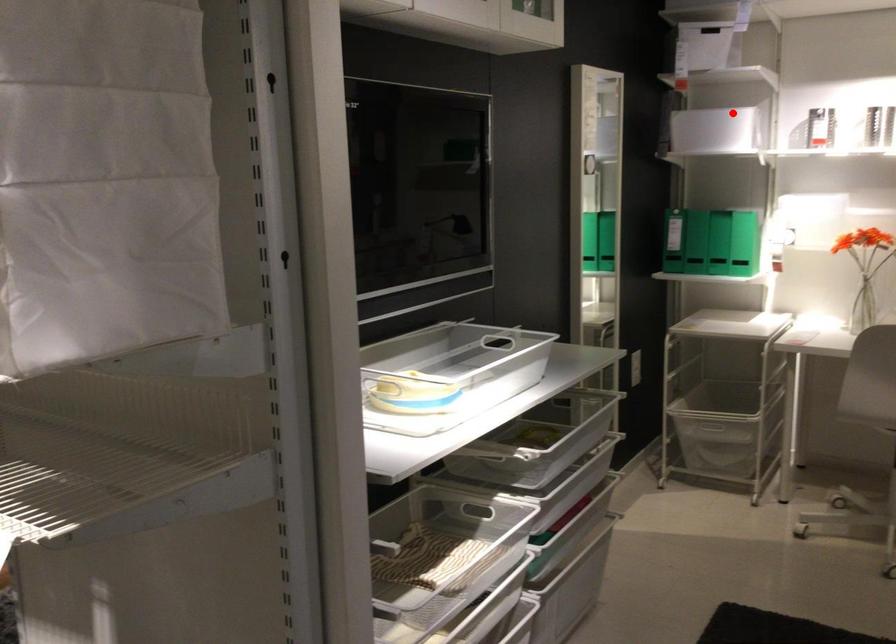
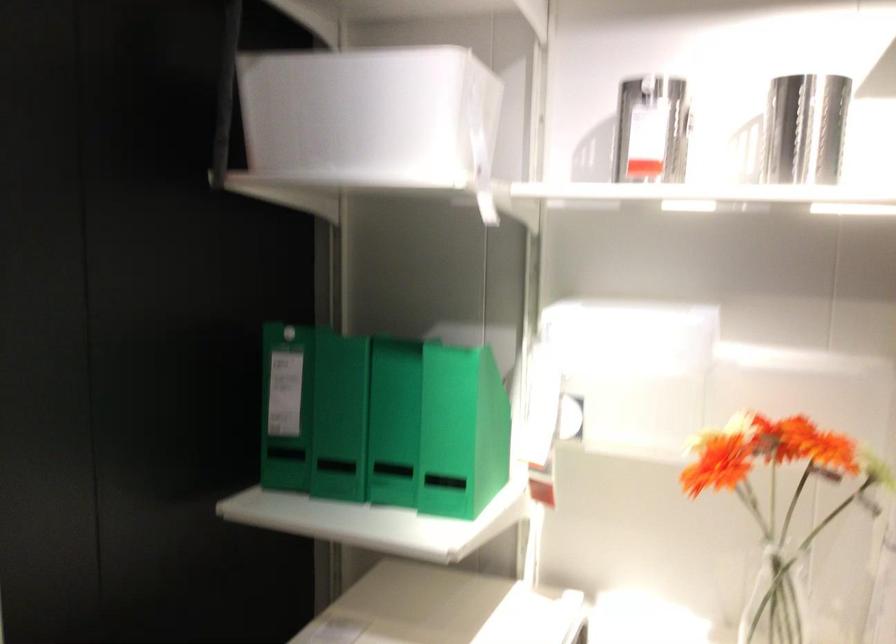
Where in the second image is the point corresponding to the highlighted location from the first image?

(373, 118)